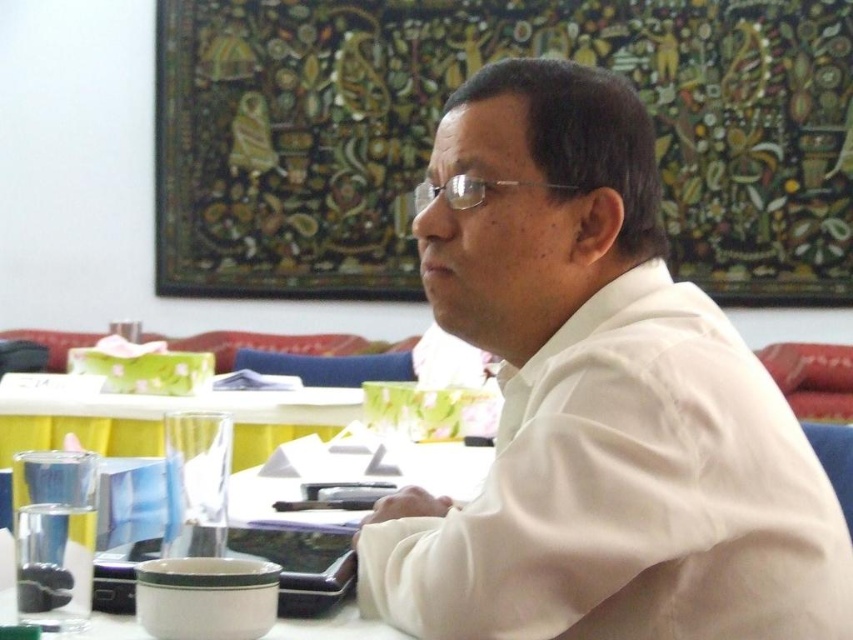
Question: Which point is closer to the camera taking this photo?

Choices:
 (A) (410, 195)
 (B) (683, 625)

Answer: (B)

Question: Is white smooth shirt at center behind clear plastic glasses at center?

Choices:
 (A) yes
 (B) no

Answer: (B)

Question: Which point appears farthest from the camera in this image?

Choices:
 (A) (578, 131)
 (B) (558, 188)

Answer: (B)

Question: Can you confirm if white smooth shirt at center is positioned to the right of clear plastic glasses at center?

Choices:
 (A) yes
 (B) no

Answer: (A)

Question: Can you confirm if white smooth shirt at center is smaller than clear plastic glasses at center?

Choices:
 (A) no
 (B) yes

Answer: (A)